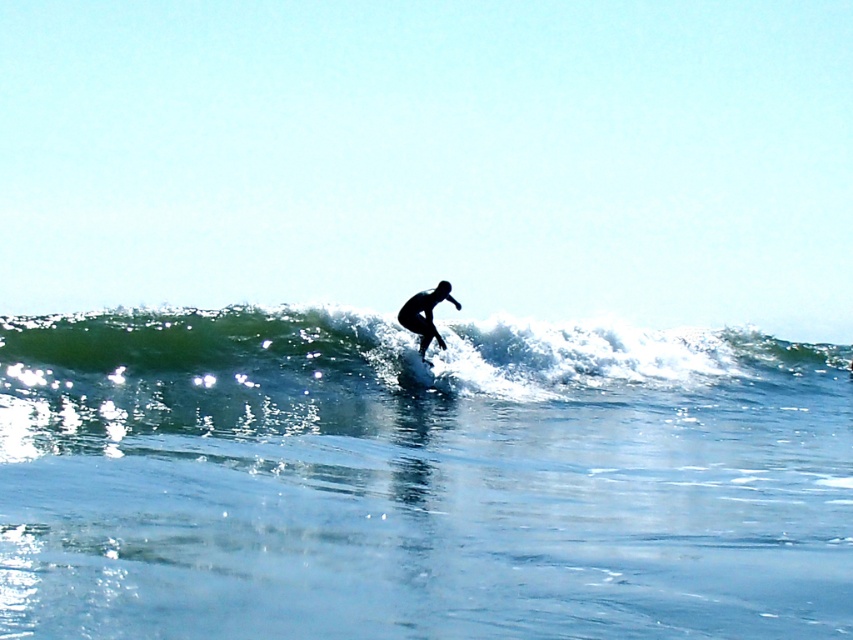
Question: Which is nearer to the black matte surfboard at center?

Choices:
 (A) green rubber wave at center
 (B) clear blue water at wave center

Answer: (A)

Question: Is green rubber wave at center to the left of black matte surfboard at center from the viewer's perspective?

Choices:
 (A) no
 (B) yes

Answer: (A)

Question: Does clear blue water at wave center appear under green rubber wave at center?

Choices:
 (A) no
 (B) yes

Answer: (B)

Question: Which of the following is the closest to the observer?

Choices:
 (A) green rubber wave at center
 (B) clear blue water at wave center
 (C) black matte surfboard at center

Answer: (B)

Question: Where is green rubber wave at center located in relation to black matte surfboard at center in the image?

Choices:
 (A) above
 (B) below

Answer: (B)

Question: Which point appears farthest from the camera in this image?

Choices:
 (A) (639, 378)
 (B) (451, 304)
 (C) (97, 547)

Answer: (A)